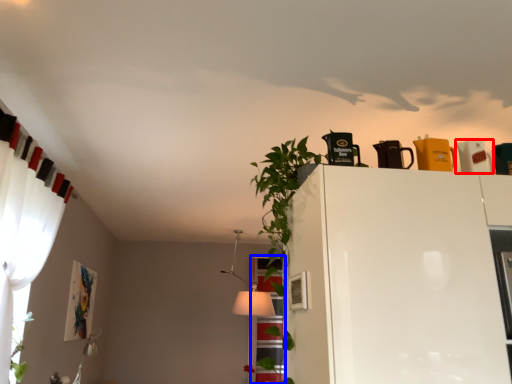
Question: Which object appears farthest to the camera in this image, appliance (highlighted by a red box) or window (highlighted by a blue box)?

Choices:
 (A) appliance
 (B) window

Answer: (B)